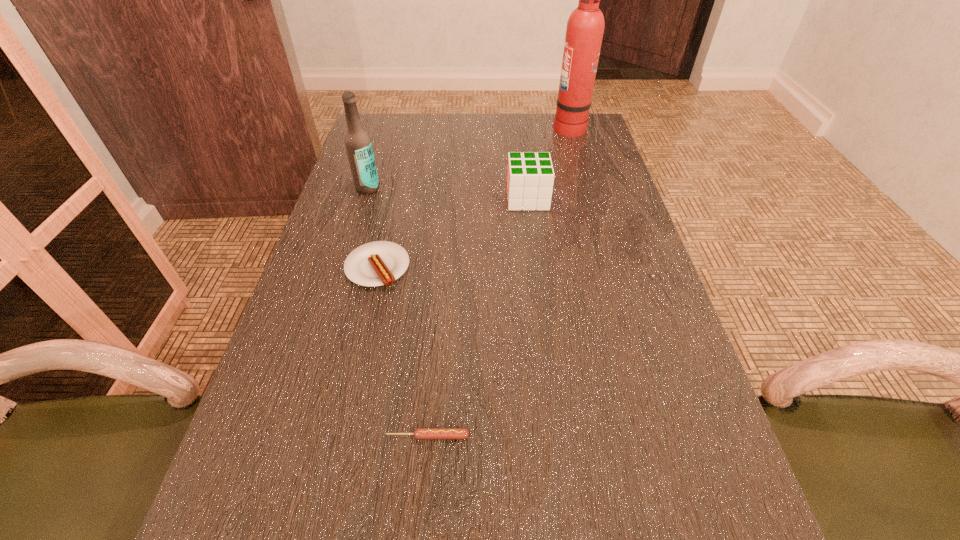
This screenshot has height=540, width=960. What are the coordinates of `sausage at the left edge` in the screenshot? It's located at (378, 263).

Locate an element on the screen. This screenshot has width=960, height=540. object that is at the right edge is located at coordinates (585, 27).

The image size is (960, 540). In order to click on object located at the far right corner in this screenshot , I will do `click(585, 27)`.

In the image, there is a desktop. Identify the location of free space at the far edge. (550, 148).

The width and height of the screenshot is (960, 540). Identify the location of free space at the left edge. (286, 429).

In the image, there is a desktop. In order to click on vacant space at the right edge in this screenshot , I will do `click(664, 516)`.

In the image, there is a desktop. Where is `free region at the far left corner`? Image resolution: width=960 pixels, height=540 pixels. free region at the far left corner is located at coordinates (380, 119).

Locate an element on the screen. The image size is (960, 540). vacant space that is in between the second shortest object and the nearer sausage is located at coordinates (403, 352).

Where is `free spot between the farthest object and the third object from left to right`? Image resolution: width=960 pixels, height=540 pixels. free spot between the farthest object and the third object from left to right is located at coordinates (498, 281).

Where is `vacant area that lies between the second object from right to left and the nearer sausage`? vacant area that lies between the second object from right to left and the nearer sausage is located at coordinates (478, 317).